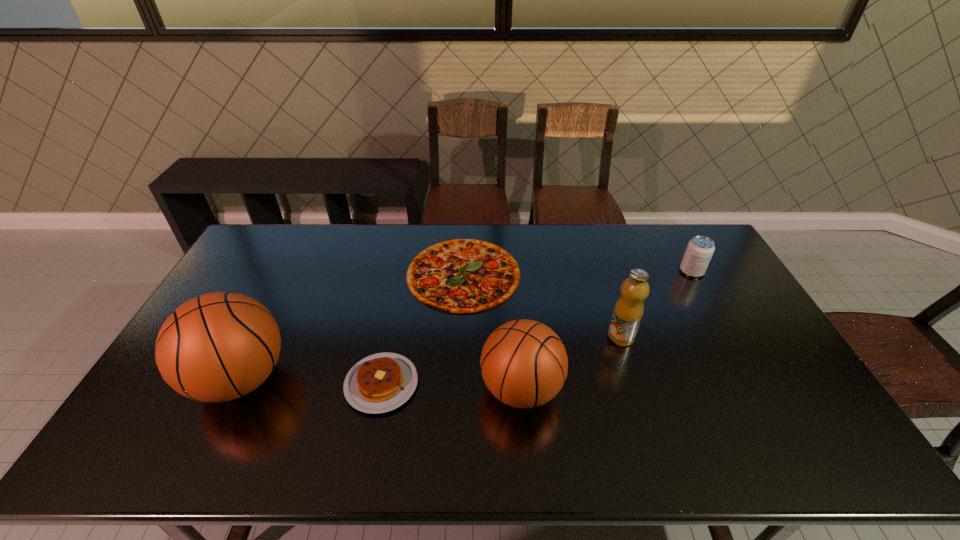
Please point a free position for a basketball on the right. Please provide its 2D coordinates. Your answer should be formatted as a tuple, i.e. [(x, y)], where the tuple contains the x and y coordinates of a point satisfying the conditions above.

[(813, 399)]